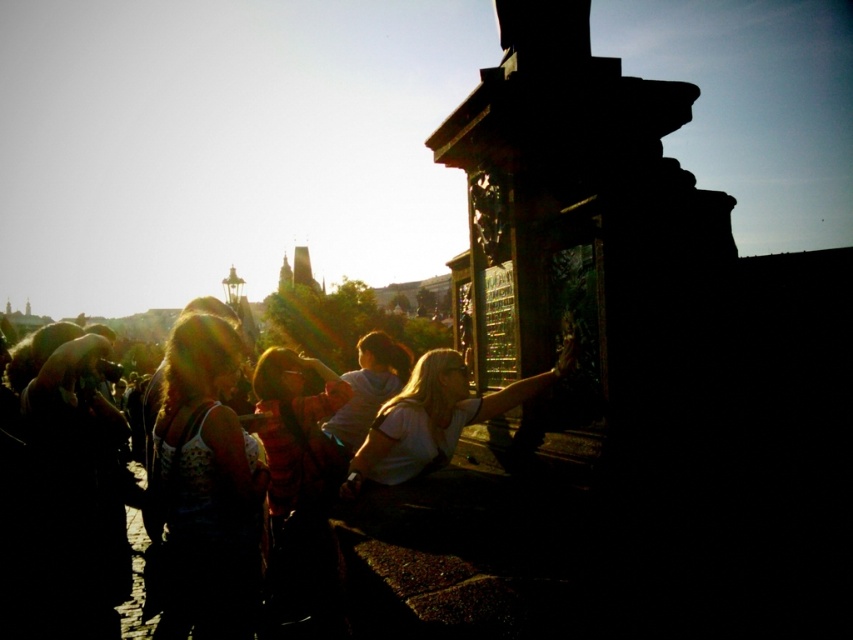
Between white cotton shirt at center and white matte shirt at center, which one is positioned lower?

Positioned lower is white cotton shirt at center.

Is point (483, 568) farther from camera compared to point (419, 408)?

No, it is in front of (419, 408).

Between point (521, 554) and point (560, 365), which one is positioned behind?

The point (560, 365) is behind.

The width and height of the screenshot is (853, 640). What are the coordinates of `white cotton shirt at center` in the screenshot? It's located at (434, 554).

Which is behind, point (509, 595) or point (165, 372)?

The point (165, 372) is more distant.

Is white cotton shirt at center wider than white textured tank top at center left?

Yes, white cotton shirt at center is wider than white textured tank top at center left.

Does point (459, 497) come behind point (219, 397)?

No, it is not.

The image size is (853, 640). Identify the location of white cotton shirt at center. (434, 554).

Can you confirm if white textured tank top at center left is positioned to the left of white matte shirt at center?

Correct, you'll find white textured tank top at center left to the left of white matte shirt at center.

Who is lower down, white textured tank top at center left or white matte shirt at center?

Positioned lower is white textured tank top at center left.

Is point (184, 444) positioned behind point (492, 408)?

Yes, point (184, 444) is farther from viewer.

What are the coordinates of `white textured tank top at center left` in the screenshot? It's located at (206, 484).